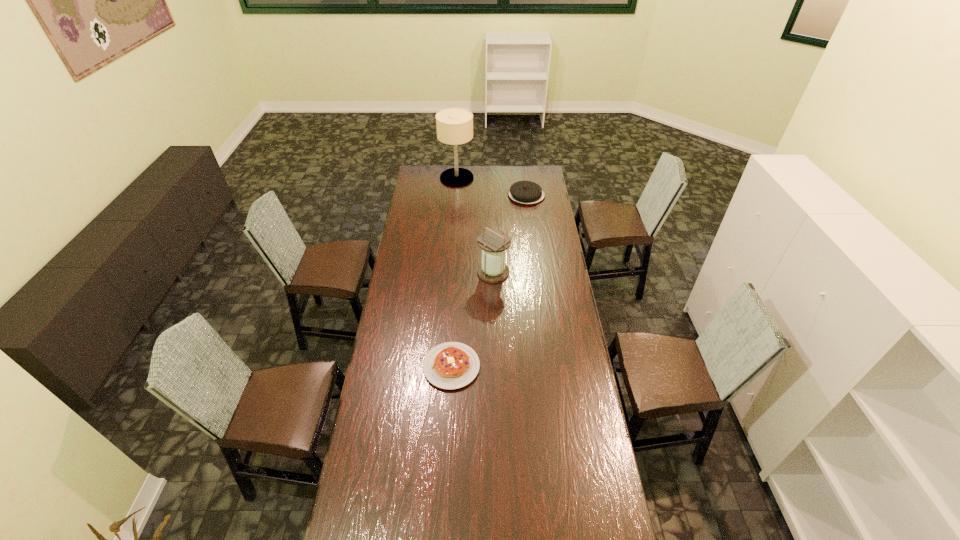
Locate an element on the screen. Image resolution: width=960 pixels, height=540 pixels. empty space that is in between the tallest object and the right pancake is located at coordinates (492, 186).

You are a GUI agent. You are given a task and a screenshot of the screen. Output one action in this format:
    pyautogui.click(x=<x>, y=<y>)
    Task: Click on the free space between the tallest object and the third shortest object
    The width and height of the screenshot is (960, 540).
    Given the screenshot: What is the action you would take?
    pyautogui.click(x=475, y=225)

Locate an element on the screen. The height and width of the screenshot is (540, 960). vacant space that's between the second tallest object and the nearest object is located at coordinates (472, 319).

The image size is (960, 540). Find the location of `free space between the tallest object and the lantern`. free space between the tallest object and the lantern is located at coordinates (475, 225).

At what (x,y) coordinates should I click in order to perform the action: click on vacant area between the tallest object and the nearest object. Please return your answer as a coordinate pair (x, y). The width and height of the screenshot is (960, 540). Looking at the image, I should click on (454, 272).

Locate an element on the screen. The height and width of the screenshot is (540, 960). vacant area that lies between the tallest object and the third tallest object is located at coordinates (x=492, y=186).

Identify the location of object that is the third closest to the taller pancake. (451, 365).

Identify which object is the second closest to the third farthest object. Please provide its 2D coordinates. Your answer should be formatted as a tuple, i.e. [(x, y)], where the tuple contains the x and y coordinates of a point satisfying the conditions above.

[(524, 192)]

This screenshot has width=960, height=540. I want to click on free location that satisfies the following two spatial constraints: 1. on the front side of the right pancake; 2. on the right side of the table lamp, so click(456, 195).

The height and width of the screenshot is (540, 960). I want to click on vacant space that satisfies the following two spatial constraints: 1. on the front side of the tallest object; 2. on the left side of the shorter pancake, so click(x=444, y=367).